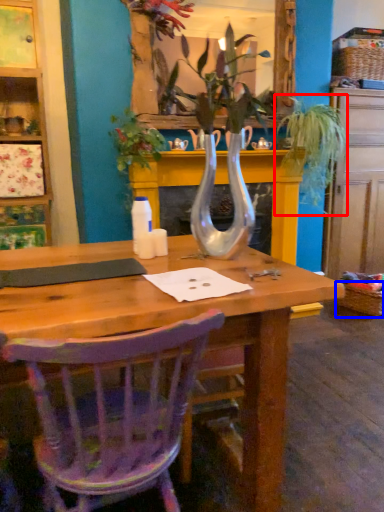
Question: Which object is further to the camera taking this photo, houseplant (highlighted by a red box) or picnic basket (highlighted by a blue box)?

Choices:
 (A) houseplant
 (B) picnic basket

Answer: (B)